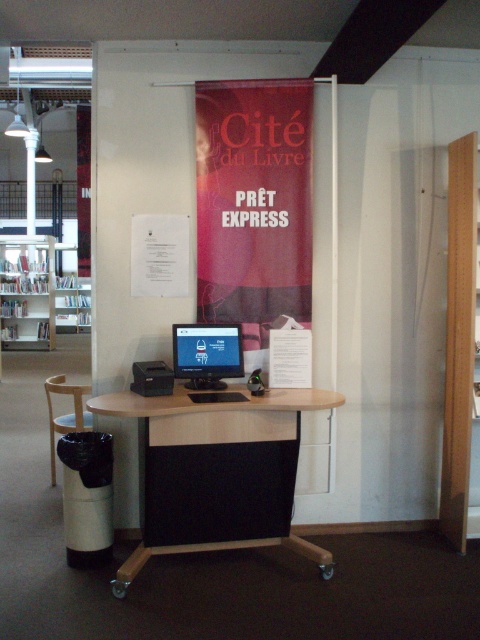
Which of these two, matte red banner at center or wooden desk at center, stands taller?

matte red banner at center

Does point (303, 134) lie in front of point (261, 440)?

No, (303, 134) is further to viewer.

Does point (274, 86) come behind point (175, 524)?

Yes.

Image resolution: width=480 pixels, height=640 pixels. I want to click on matte red banner at center, so click(x=253, y=204).

This screenshot has width=480, height=640. What do you see at coordinates (216, 470) in the screenshot?
I see `wooden desk at center` at bounding box center [216, 470].

Can you confirm if wooden desk at center is wider than matte black monitor at center?

Yes, wooden desk at center is wider than matte black monitor at center.

Who is more forward, (x=315, y=390) or (x=228, y=348)?

Positioned in front is point (x=228, y=348).

Identify the location of wooden desk at center. The height and width of the screenshot is (640, 480). (216, 470).

Can you confirm if matte red banner at center is positioned to the right of matte black monitor at center?

Yes, matte red banner at center is to the right of matte black monitor at center.

Between point (266, 326) and point (212, 368), which one is positioned in front?

Positioned in front is point (212, 368).

Between point (260, 312) and point (184, 348), which one is positioned behind?

Point (260, 312)

Identify the location of matte red banner at center. (253, 204).